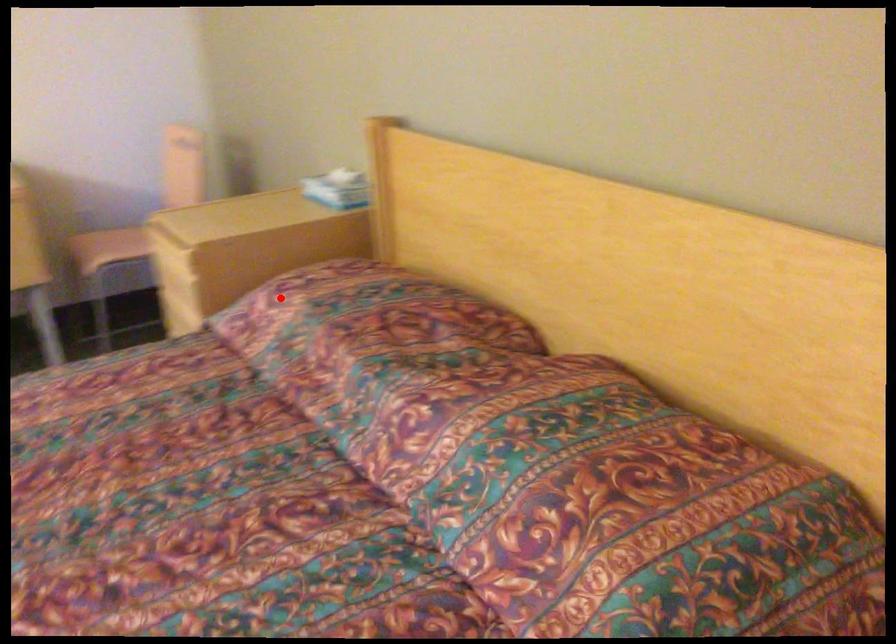
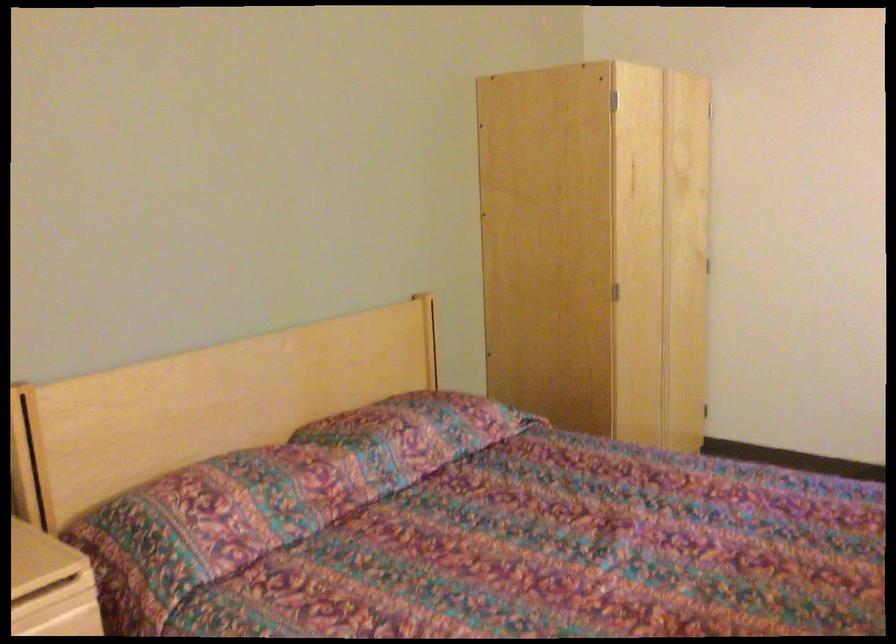
Find the pixel in the second image that matches the highlighted location in the first image.

(211, 518)